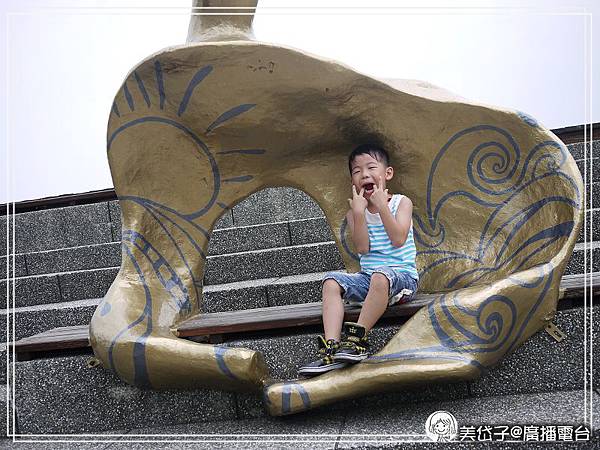
Where is `frames`? frames is located at coordinates (398, 432), (400, 439).